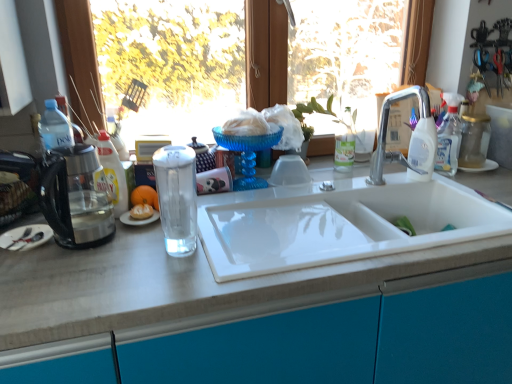
At what (x,y) coordinates should I click in order to perform the action: click on vacant space positioned to the left of clear glass water at center. Please return your answer as a coordinate pair (x, y). The height and width of the screenshot is (384, 512). Looking at the image, I should click on (126, 251).